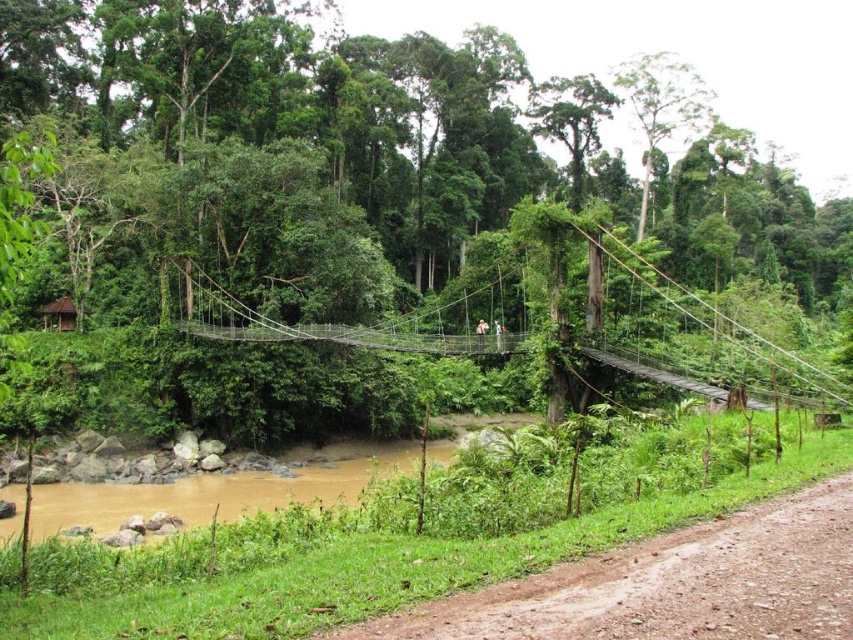
Question: Among these points, which one is nearest to the camera?

Choices:
 (A) (467, 609)
 (B) (808, 380)

Answer: (A)

Question: Can you confirm if brown dirt track at lower right is smaller than wire mesh bridge at center?

Choices:
 (A) yes
 (B) no

Answer: (A)

Question: Does brown dirt track at lower right appear under wire mesh bridge at center?

Choices:
 (A) yes
 (B) no

Answer: (A)

Question: Does brown dirt track at lower right lie in front of wire mesh bridge at center?

Choices:
 (A) no
 (B) yes

Answer: (B)

Question: Which point is farther from the camera taking this photo?

Choices:
 (A) (643, 572)
 (B) (241, 340)

Answer: (B)